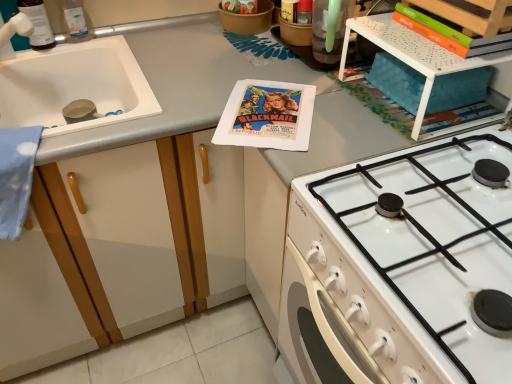
Where is `empty space that is to the right of translucent plastic bottle at upper left, which is the first bottle from left to right`? The image size is (512, 384). empty space that is to the right of translucent plastic bottle at upper left, which is the first bottle from left to right is located at coordinates (108, 43).